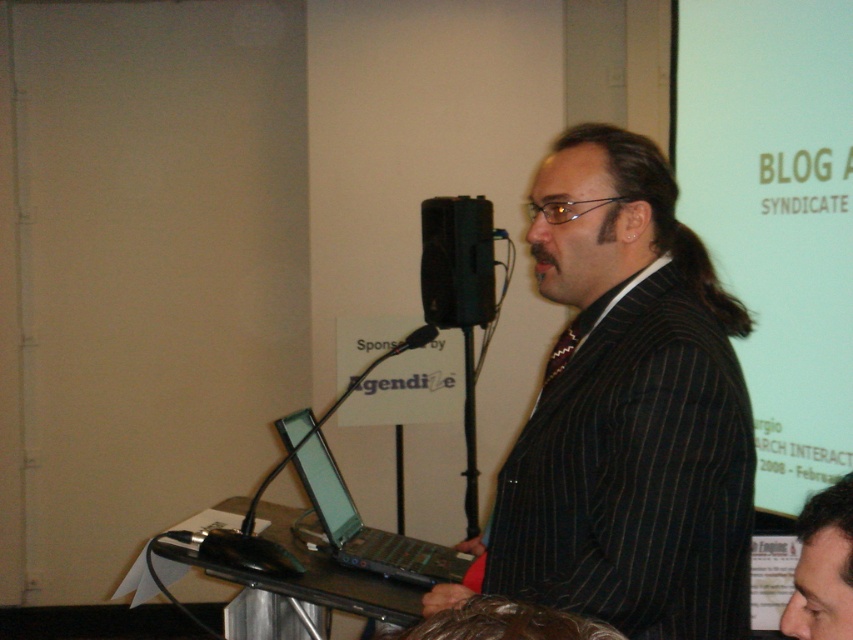
Question: Which of these objects is positioned farthest from the black plastic microphone at center?

Choices:
 (A) black plastic speaker at center
 (B) black plastic laptop at lower left
 (C) matte white projection screen at upper right
 (D) smooth skin face at lower right

Answer: (D)

Question: Does matte white projection screen at upper right appear on the right side of matte black laptop at lower left?

Choices:
 (A) yes
 (B) no

Answer: (A)

Question: Which of the following is the farthest from the observer?

Choices:
 (A) dark pinstripe suit at center
 (B) black plastic microphone at center

Answer: (B)

Question: Which object is farther from the camera taking this photo?

Choices:
 (A) matte black laptop at lower left
 (B) smooth skin face at lower right

Answer: (A)

Question: Can you confirm if black plastic laptop at lower left is bigger than matte black laptop at lower left?

Choices:
 (A) no
 (B) yes

Answer: (B)

Question: Does black plastic laptop at lower left appear on the left side of black plastic speaker at center?

Choices:
 (A) no
 (B) yes

Answer: (B)